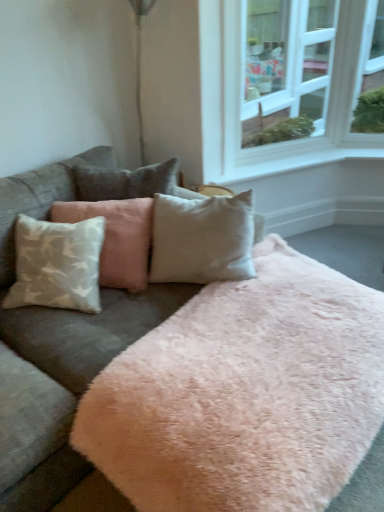
Question: Considering the relative sizes of white glass window at upper right and white textured pillow at left in the image provided, is white glass window at upper right taller than white textured pillow at left?

Choices:
 (A) yes
 (B) no

Answer: (A)

Question: Is white glass window at upper right thinner than white textured pillow at left?

Choices:
 (A) yes
 (B) no

Answer: (A)

Question: Is white glass window at upper right in contact with white textured pillow at left?

Choices:
 (A) yes
 (B) no

Answer: (B)

Question: Could you tell me if white glass window at upper right is facing white textured pillow at left?

Choices:
 (A) no
 (B) yes

Answer: (A)

Question: From a real-world perspective, does white glass window at upper right sit lower than white textured pillow at left?

Choices:
 (A) yes
 (B) no

Answer: (B)

Question: Is white textured pillow at left wider or thinner than velvet gray couch at center?

Choices:
 (A) thin
 (B) wide

Answer: (A)

Question: In the image, is white textured pillow at left positioned in front of or behind velvet gray couch at center?

Choices:
 (A) front
 (B) behind

Answer: (B)

Question: Visually, is white textured pillow at left positioned to the left or to the right of velvet gray couch at center?

Choices:
 (A) right
 (B) left

Answer: (B)

Question: From a real-world perspective, is white textured pillow at left positioned above or below velvet gray couch at center?

Choices:
 (A) above
 (B) below

Answer: (A)

Question: Do you think velvet gray couch at center is within white smooth window sill at center, or outside of it?

Choices:
 (A) inside
 (B) outside

Answer: (B)

Question: Is velvet gray couch at center taller or shorter than white smooth window sill at center?

Choices:
 (A) tall
 (B) short

Answer: (A)

Question: Considering their positions, is velvet gray couch at center located in front of or behind white smooth window sill at center?

Choices:
 (A) behind
 (B) front

Answer: (B)

Question: Is point (26, 500) closer or farther from the camera than point (259, 165)?

Choices:
 (A) farther
 (B) closer

Answer: (B)

Question: From a real-world perspective, is white smooth window sill at center above or below velvet gray couch at center?

Choices:
 (A) above
 (B) below

Answer: (A)

Question: Considering the positions of white smooth window sill at center and velvet gray couch at center in the image, is white smooth window sill at center taller or shorter than velvet gray couch at center?

Choices:
 (A) tall
 (B) short

Answer: (B)